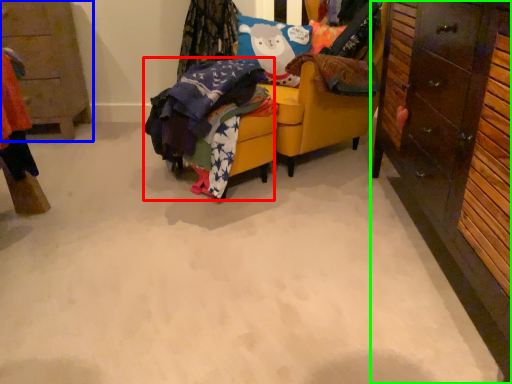
Question: Based on their relative distances, which object is nearer to clothing (highlighted by a red box)? Choose from cabinetry (highlighted by a blue box) and cabinetry (highlighted by a green box).

Choices:
 (A) cabinetry
 (B) cabinetry

Answer: (B)